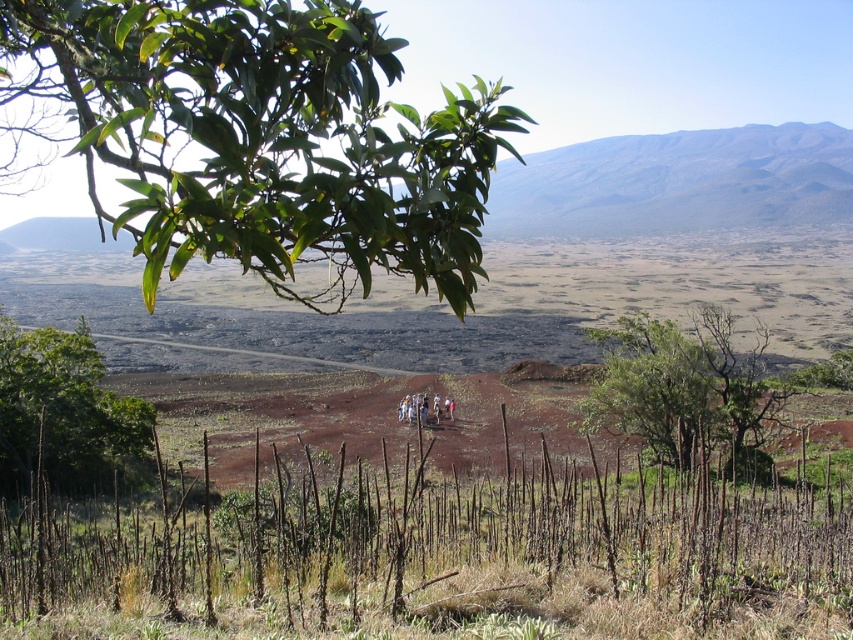
You are a hiker lost in a volcanic terrain and see the green leafy tree at center and the green leafy tree at lower left. Which tree is closer to you?

The green leafy tree at center is positioned under the green leafy tree at lower left, so the tree at lower left is closer to you.

You are an environmental scientist studying the volcanic terrain. You notice the green glossy leaves at upper left and the green leafy tree at lower left. Which one has a greater height?

The green glossy leaves at upper left is taller than the green leafy tree at lower left according to the description.

You are a botanist examining the volcanic terrain. You notice the green glossy leaves at upper left and the green leafy tree at center. Which of these two plants is positioned higher in the image?

The green glossy leaves at upper left are positioned higher than the green leafy tree at center in the image.